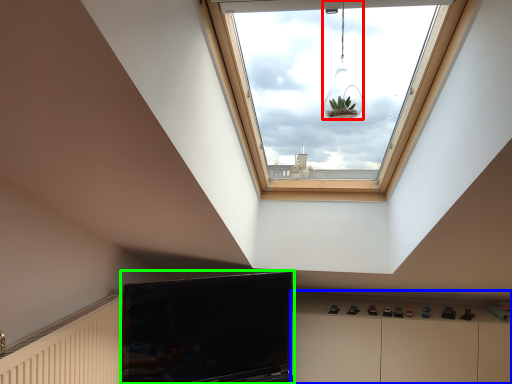
Question: Which is farther away from light fixture (highlighted by a red box)? dresser (highlighted by a blue box) or television (highlighted by a green box)?

Choices:
 (A) dresser
 (B) television

Answer: (A)